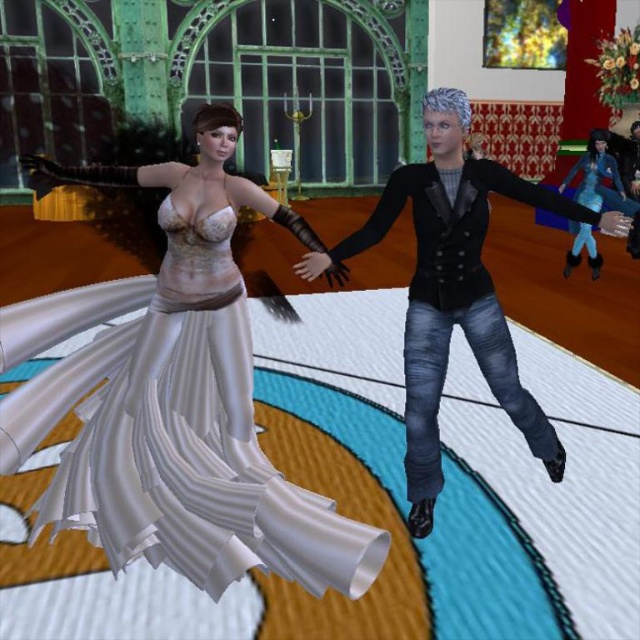
Based on the photo, you are a fashion designer observing a runway show. You notice two outfits at the center of the stage, a white satin dress at center and denim jeans at center. Which one is positioned to the left?

The white satin dress at center is positioned to the left of the denim jeans at center.

You are a tailor who needs to determine which clothing item is taller between the white satin dress at center and the denim jeans at center. Based on the scene description, which one is taller?

The white satin dress at center is much taller than the denim jeans at center, so the white satin dress at center is taller.

You are a fashion designer observing the scene. You need to determine which clothing item is closer to the ground. The scene has a white satin dress at center and denim jeans at center. Which one is lower?

The white satin dress at center is positioned under denim jeans at center, so the white satin dress at center is lower.